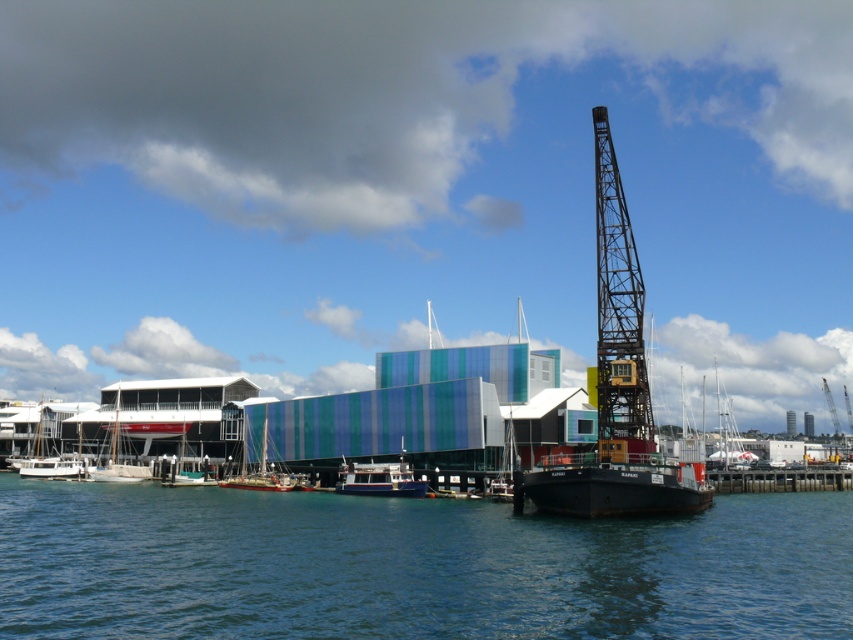
Can you confirm if black matte boat at center is taller than white glossy boat at lower left?

Yes, black matte boat at center is taller than white glossy boat at lower left.

Based on the photo, does black matte boat at center have a larger size compared to white glossy boat at lower left?

No.

This screenshot has width=853, height=640. What are the coordinates of `black matte boat at center` in the screenshot? It's located at (616, 388).

Locate an element on the screen. Image resolution: width=853 pixels, height=640 pixels. black matte boat at center is located at coordinates (616, 388).

Which is more to the left, blue water at lower left or black metal crane at center?

From the viewer's perspective, blue water at lower left appears more on the left side.

Is blue water at lower left positioned at the back of black metal crane at center?

No.

Between point (196, 598) and point (595, 173), which one is positioned in front?

Point (196, 598) is more forward.

Where is `blue water at lower left`? This screenshot has width=853, height=640. blue water at lower left is located at coordinates (410, 566).

Based on the photo, can you confirm if blue water at lower left is smaller than black matte boat at center?

Indeed, blue water at lower left has a smaller size compared to black matte boat at center.

Does blue water at lower left appear on the left side of black matte boat at center?

Indeed, blue water at lower left is positioned on the left side of black matte boat at center.

Find the location of a particular element. This screenshot has width=853, height=640. blue water at lower left is located at coordinates coord(410,566).

Image resolution: width=853 pixels, height=640 pixels. I want to click on blue water at lower left, so click(410, 566).